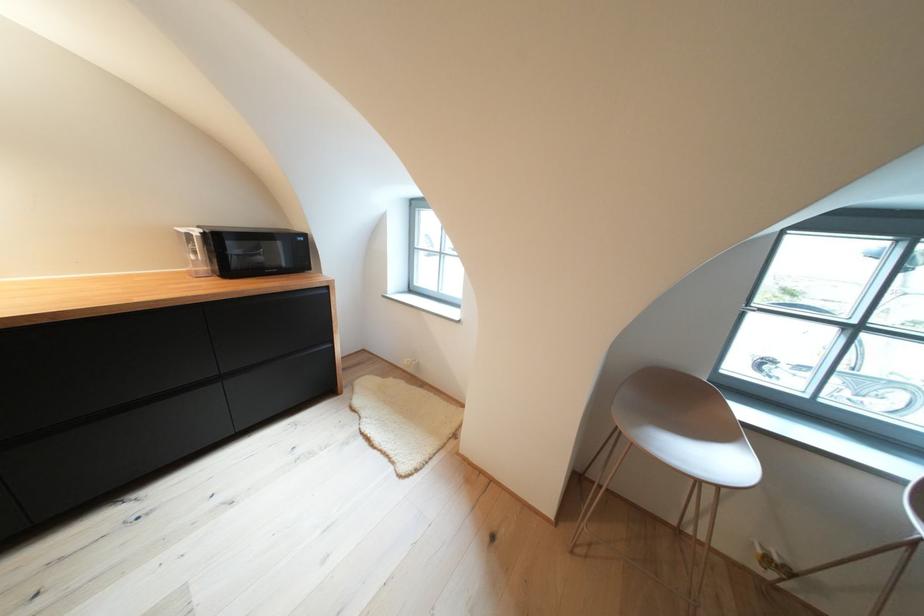
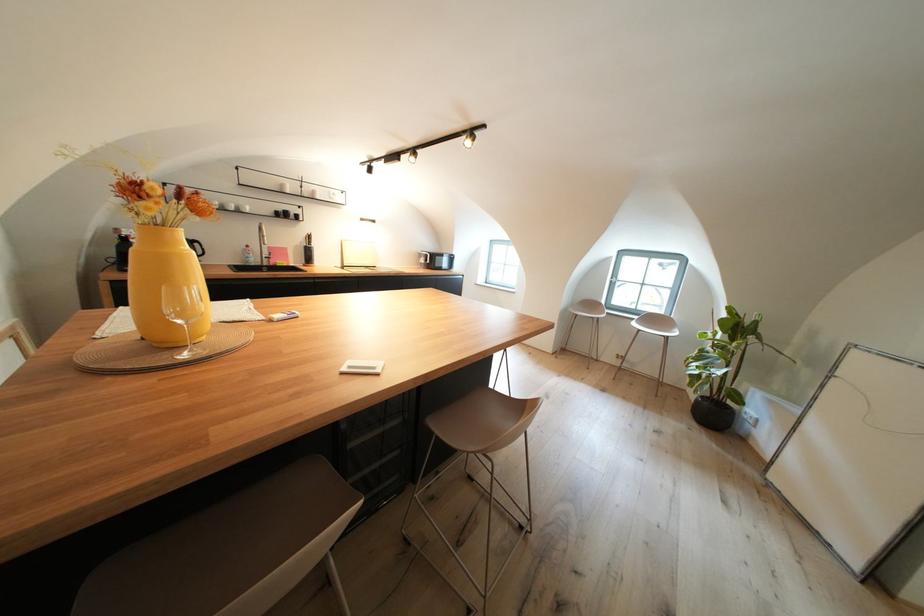
Question: Which direction would the cameraman need to move to produce the second image? Reply with the corresponding letter.

Choices:
 (A) Left
 (B) Right
 (C) Forward
 (D) Backward

Answer: (D)